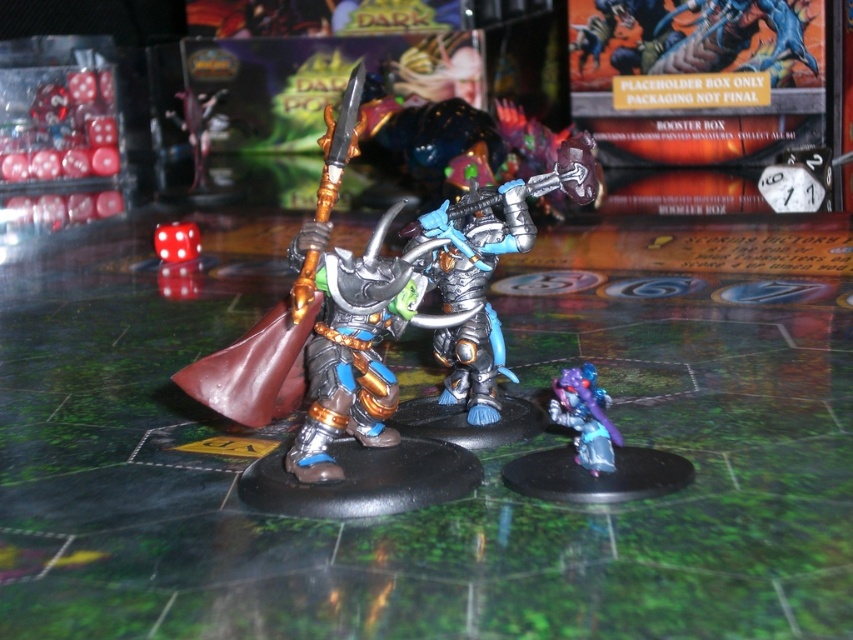
Question: Can you confirm if metallic blue figure at lower right is positioned to the left of shiny purple armor at lower right?

Choices:
 (A) no
 (B) yes

Answer: (A)

Question: Considering the real-world distances, which object is closest to the translucent red dice at left?

Choices:
 (A) white plastic die at center
 (B) white plastic clock at upper right
 (C) white matte dice at left

Answer: (C)

Question: Can you confirm if translucent red dice at left is positioned above white matte dice at left?

Choices:
 (A) no
 (B) yes

Answer: (B)

Question: Which point is closer to the camera?

Choices:
 (A) translucent red dice at left
 (B) shiny purple armor at lower right
 (C) white plastic clock at upper right

Answer: (B)

Question: Estimate the real-world distances between objects in this image. Which object is farther from the white matte dice at left?

Choices:
 (A) metallic blue figure at lower right
 (B) white plastic clock at upper right

Answer: (B)

Question: Where is shiny purple armor at lower right located in relation to white plastic die at center in the image?

Choices:
 (A) above
 (B) below

Answer: (B)